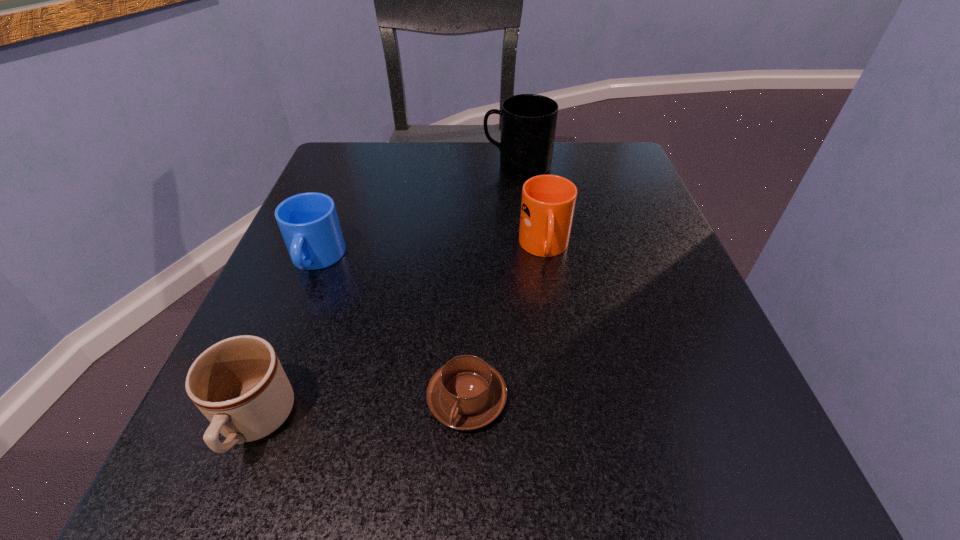
You are a GUI agent. You are given a task and a screenshot of the screen. Output one action in this format:
    pyautogui.click(x=<x>, y=<y>)
    Task: Click on the blank region between the shortest object and the farthest mug
    The height and width of the screenshot is (540, 960).
    Given the screenshot: What is the action you would take?
    pyautogui.click(x=492, y=282)

Identify the location of free point between the nearest mug and the farthest mug. The height and width of the screenshot is (540, 960). (386, 294).

You are a GUI agent. You are given a task and a screenshot of the screen. Output one action in this format:
    pyautogui.click(x=<x>, y=<y>)
    Task: Click on the vacant area that lies between the shortest object and the nearest mug
    
    Given the screenshot: What is the action you would take?
    pyautogui.click(x=361, y=411)

I want to click on object that is the fourth closest to the tallest mug, so [x=239, y=385].

Select which object appears as the closest to the tallest object. Please provide its 2D coordinates. Your answer should be formatted as a tuple, i.e. [(x, y)], where the tuple contains the x and y coordinates of a point satisfying the conditions above.

[(548, 202)]

The height and width of the screenshot is (540, 960). What are the coordinates of `mug object that ranks as the closest to the nearest mug` in the screenshot? It's located at (309, 224).

Point out which mug is positioned as the nearest to the cappuccino. Please provide its 2D coordinates. Your answer should be formatted as a tuple, i.e. [(x, y)], where the tuple contains the x and y coordinates of a point satisfying the conditions above.

[(239, 385)]

Identify the location of vacant position in the image that satisfies the following two spatial constraints: 1. on the side of the tallest object with the handle; 2. on the side of the nearest mug with the handle. (547, 423).